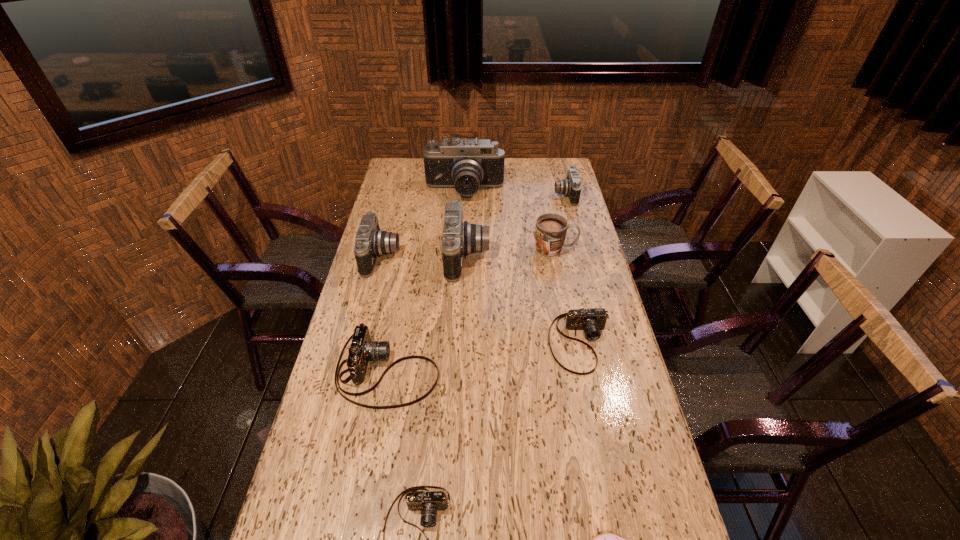
Find the location of a particular element. the tallest camera is located at coordinates (466, 165).

The width and height of the screenshot is (960, 540). I want to click on the tallest object, so click(466, 165).

This screenshot has height=540, width=960. In order to click on the second biggest black camera in this screenshot , I will do `click(459, 237)`.

Where is `the second tallest camera`? The height and width of the screenshot is (540, 960). the second tallest camera is located at coordinates (459, 237).

The image size is (960, 540). I want to click on the leftmost black camera, so click(370, 242).

The width and height of the screenshot is (960, 540). I want to click on the third biggest black camera, so click(x=370, y=242).

Find the location of a particular element. mug is located at coordinates pos(550,232).

Find the location of a particular element. This screenshot has width=960, height=540. the fourth tallest camera is located at coordinates (571, 187).

I want to click on the rightmost black camera, so click(571, 187).

At what (x,y) coordinates should I click in order to perform the action: click on the sixth tallest object. Please return your answer as a coordinate pair (x, y). This screenshot has width=960, height=540. Looking at the image, I should click on [362, 350].